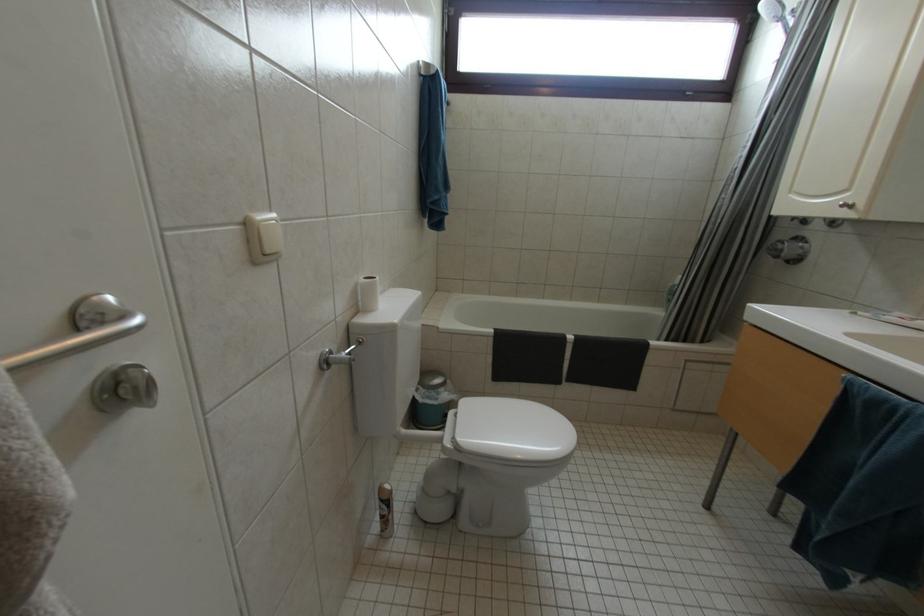
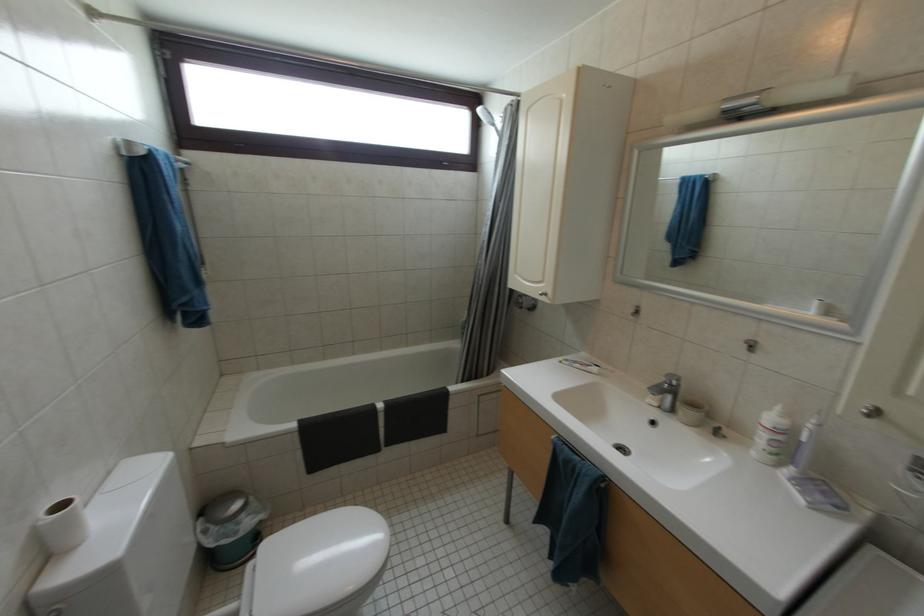
Question: The first image is from the beginning of the video and the second image is from the end. How did the camera likely rotate when shooting the video?

Choices:
 (A) Left
 (B) Right
 (C) Up
 (D) Down

Answer: (B)